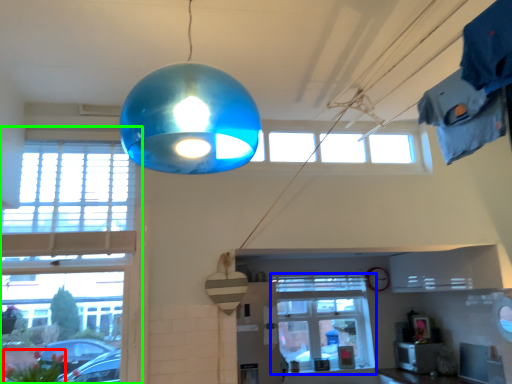
Question: Which object is the closest to the flower (highlighted by a red box)? Choose among these: window (highlighted by a blue box) or window (highlighted by a green box).

Choices:
 (A) window
 (B) window

Answer: (B)